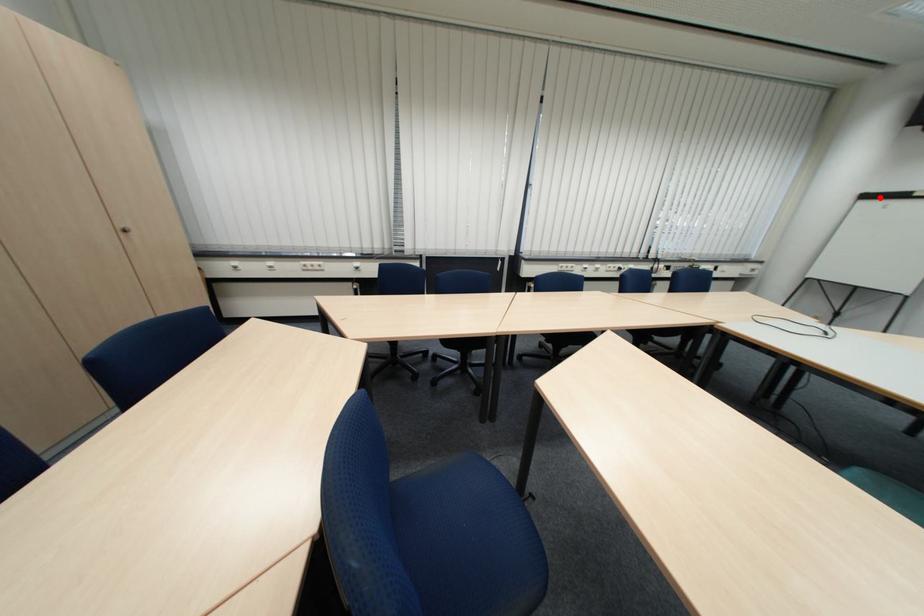
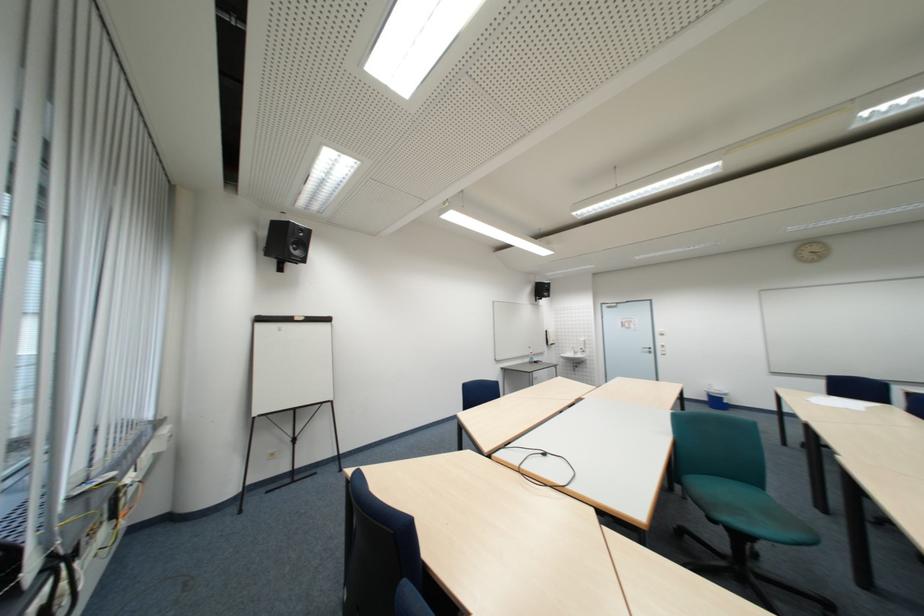
Locate, in the second image, the point that corresponds to the highlighted location in the first image.

(273, 321)